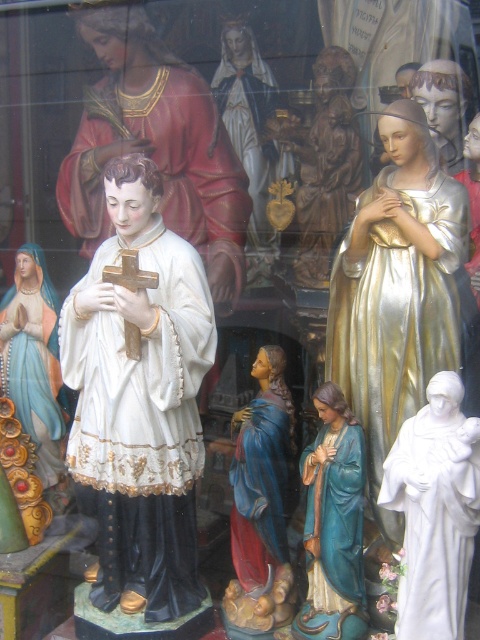
You are a GUI agent. You are given a task and a screenshot of the screen. Output one action in this format:
    pyautogui.click(x=<x>, y=<y>)
    Task: Click on the matte white statue at center
    The width and height of the screenshot is (480, 640).
    Given the screenshot: What is the action you would take?
    pyautogui.click(x=156, y=147)

Does matte white statue at center appear on the left side of wooden cross at center?

Yes, matte white statue at center is to the left of wooden cross at center.

Is point (74, 220) closer to viewer compared to point (124, 342)?

No.

Locate an element on the screen. matte white statue at center is located at coordinates (156, 147).

Does blue glossy statue at lower center appear on the left side of gold leaf statue at center?

In fact, blue glossy statue at lower center is to the right of gold leaf statue at center.

Between blue glossy statue at lower center and gold leaf statue at center, which one has more height?

gold leaf statue at center

The width and height of the screenshot is (480, 640). I want to click on blue glossy statue at lower center, so pyautogui.click(x=334, y=524).

This screenshot has width=480, height=640. I want to click on blue glossy statue at lower center, so click(x=334, y=524).

Does point (445, 220) come closer to viewer compared to point (16, 292)?

That is True.

Is point (432, 298) more distant than point (22, 381)?

No.

This screenshot has width=480, height=640. What are the coordinates of `gold glossy statue at upper right` in the screenshot? It's located at (397, 291).